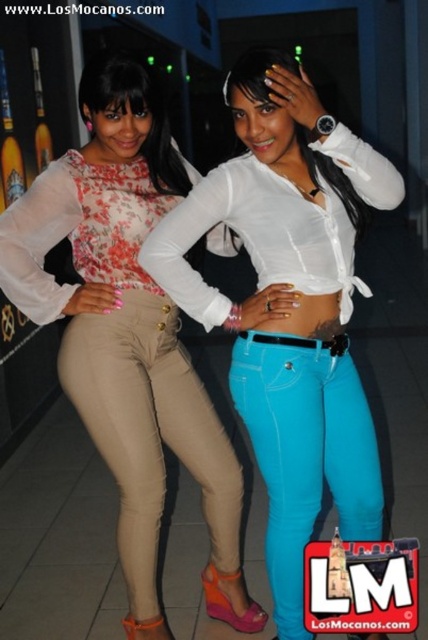
Question: Can you confirm if white glossy shirt at center is smaller than beige leather pants at left?

Choices:
 (A) no
 (B) yes

Answer: (A)

Question: Which point is farther to the camera?

Choices:
 (A) white glossy shirt at center
 (B) beige leather pants at left

Answer: (B)

Question: Which point appears closest to the camera in this image?

Choices:
 (A) (273, 342)
 (B) (196, 480)
 (C) (74, 204)
 (D) (299, 388)

Answer: (D)

Question: Does white glossy shirt at center lie behind matte floral blouse at center?

Choices:
 (A) yes
 (B) no

Answer: (B)

Question: Observing the image, what is the correct spatial positioning of white glossy shirt at center in reference to turquoise denim jeans at center?

Choices:
 (A) right
 (B) left

Answer: (B)

Question: Which object is farther from the camera taking this photo?

Choices:
 (A) matte floral blouse at center
 (B) white glossy shirt at center
 (C) beige leather pants at left
 (D) turquoise denim jeans at center

Answer: (C)